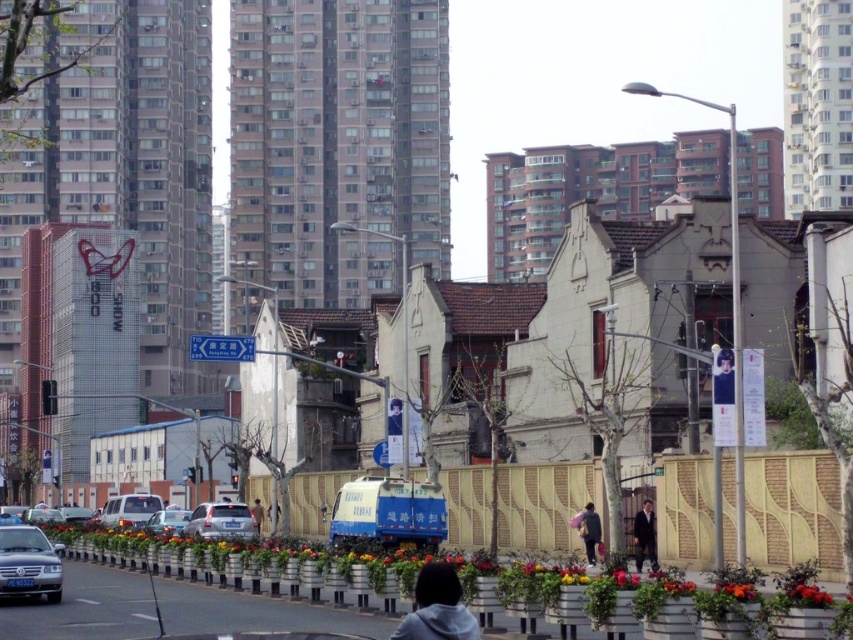
You are a pedestrian standing at the crosswalk in this urban scene. You need to cross the street safely. Which vehicle, the blue metallic truck at center or the matte silver sedan at lower left, is closer to you?

The blue metallic truck at center is closer to you because it is positioned in front of the matte silver sedan at lower left.

You are standing at the point of reference and want to locate the blue metallic truck at center. What are the coordinates where you can find it?

The blue metallic truck at center is located at coordinates point (389, 513).

Please look at the image. There is a point marked at coordinates (219, 522). What object is located at this point?

The point at (219, 522) marks the location of a satin silver sedan at center.